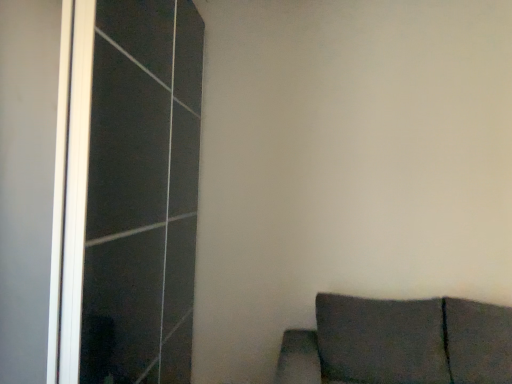
Question: Is transparent glass screen door at left to the left or to the right of dark fabric couch at lower right in the image?

Choices:
 (A) right
 (B) left

Answer: (B)

Question: From the image's perspective, is transparent glass screen door at left above or below dark fabric couch at lower right?

Choices:
 (A) above
 (B) below

Answer: (A)

Question: Choose the correct answer: Is transparent glass screen door at left inside dark fabric couch at lower right or outside it?

Choices:
 (A) outside
 (B) inside

Answer: (A)

Question: Does point (384, 336) appear closer or farther from the camera than point (120, 203)?

Choices:
 (A) farther
 (B) closer

Answer: (A)

Question: From a real-world perspective, is dark fabric couch at lower right physically located above or below transparent glass screen door at left?

Choices:
 (A) above
 (B) below

Answer: (B)

Question: Is dark fabric couch at lower right wider or thinner than transparent glass screen door at left?

Choices:
 (A) wide
 (B) thin

Answer: (A)

Question: From the image's perspective, is dark fabric couch at lower right above or below transparent glass screen door at left?

Choices:
 (A) above
 (B) below

Answer: (B)